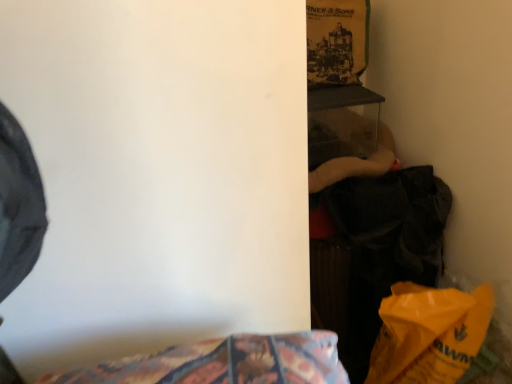
What is the approximate width of dark gray fabric at right?

dark gray fabric at right is 9.61 inches in width.

Image resolution: width=512 pixels, height=384 pixels. What do you see at coordinates (374, 252) in the screenshot?
I see `dark gray fabric at right` at bounding box center [374, 252].

From the picture: What is the approximate height of dark gray fabric at right?

dark gray fabric at right is 70.97 centimeters tall.

This screenshot has height=384, width=512. I want to click on dark gray fabric at right, so click(374, 252).

Describe the element at coordinates (429, 334) in the screenshot. The width and height of the screenshot is (512, 384). I see `yellow matte paper bag at lower right` at that location.

At what (x,y) coordinates should I click in order to perform the action: click on yellow matte paper bag at lower right. Please return your answer as a coordinate pair (x, y). Looking at the image, I should click on pos(429,334).

The width and height of the screenshot is (512, 384). Identify the location of dark gray fabric at right. (374, 252).

Would you say yellow matte paper bag at lower right is to the left or to the right of dark gray fabric at right in the picture?

Clearly, yellow matte paper bag at lower right is on the right of dark gray fabric at right in the image.

Is the position of yellow matte paper bag at lower right more distant than that of dark gray fabric at right?

No, yellow matte paper bag at lower right is closer to the viewer.

Considering the positions of point (487, 324) and point (372, 326), is point (487, 324) closer or farther from the camera than point (372, 326)?

Point (487, 324).

From the image's perspective, which is above, yellow matte paper bag at lower right or dark gray fabric at right?

From the image's view, dark gray fabric at right is above.

From a real-world perspective, is yellow matte paper bag at lower right positioned under dark gray fabric at right based on gravity?

Yes, from a real-world perspective, yellow matte paper bag at lower right is below dark gray fabric at right.

Is yellow matte paper bag at lower right wider or thinner than dark gray fabric at right?

Clearly, yellow matte paper bag at lower right has less width compared to dark gray fabric at right.

Is yellow matte paper bag at lower right taller than dark gray fabric at right?

Incorrect, the height of yellow matte paper bag at lower right is not larger of that of dark gray fabric at right.

Which of these two, yellow matte paper bag at lower right or dark gray fabric at right, is smaller?

With smaller size is yellow matte paper bag at lower right.

Would you say dark gray fabric at right is part of yellow matte paper bag at lower right's contents?

No, dark gray fabric at right is not surrounded by yellow matte paper bag at lower right.

Is yellow matte paper bag at lower right far away from dark gray fabric at right?

No, yellow matte paper bag at lower right is not far away from dark gray fabric at right.

Is yellow matte paper bag at lower right aimed at dark gray fabric at right?

No, yellow matte paper bag at lower right does not turn towards dark gray fabric at right.

How many degrees apart are the facing directions of yellow matte paper bag at lower right and dark gray fabric at right?

There is a 0.00112-degree angle between the facing directions of yellow matte paper bag at lower right and dark gray fabric at right.

Locate an element on the screen. paper bag below the dark gray fabric at right (from a real-world perspective) is located at coordinates (429, 334).

Based on their positions, is dark gray fabric at right located to the left or right of yellow matte paper bag at lower right?

dark gray fabric at right is positioned on yellow matte paper bag at lower right's left side.

Is dark gray fabric at right further to the viewer compared to yellow matte paper bag at lower right?

Yes, dark gray fabric at right is further from the camera.

Does point (368, 283) come farther from viewer compared to point (438, 300)?

Yes, point (368, 283) is farther from viewer.

From the image's perspective, is dark gray fabric at right located above yellow matte paper bag at lower right?

Yes, from the image's perspective, dark gray fabric at right is above yellow matte paper bag at lower right.

From a real-world perspective, which object rests below the other?

yellow matte paper bag at lower right, from a real-world perspective.

Considering the sizes of objects dark gray fabric at right and yellow matte paper bag at lower right in the image provided, who is thinner, dark gray fabric at right or yellow matte paper bag at lower right?

With smaller width is yellow matte paper bag at lower right.

Can you confirm if dark gray fabric at right is taller than yellow matte paper bag at lower right?

Yes.

Which of these two, dark gray fabric at right or yellow matte paper bag at lower right, is bigger?

With larger size is dark gray fabric at right.

Is yellow matte paper bag at lower right a part of dark gray fabric at right?

Definitely not — yellow matte paper bag at lower right is not inside dark gray fabric at right.

Is dark gray fabric at right not close to yellow matte paper bag at lower right?

Actually, dark gray fabric at right and yellow matte paper bag at lower right are a little close together.

Does dark gray fabric at right turn towards yellow matte paper bag at lower right?

Yes, dark gray fabric at right is oriented towards yellow matte paper bag at lower right.

How distant is dark gray fabric at right from yellow matte paper bag at lower right?

A distance of 12.93 inches exists between dark gray fabric at right and yellow matte paper bag at lower right.

Locate an element on the screen. paper bag on the right of dark gray fabric at right is located at coordinates (429, 334).

Where is `paper bag below the dark gray fabric at right (from the image's perspective)`? This screenshot has height=384, width=512. paper bag below the dark gray fabric at right (from the image's perspective) is located at coordinates (429, 334).

Identify the location of clothing that is above the yellow matte paper bag at lower right (from the image's perspective). (374, 252).